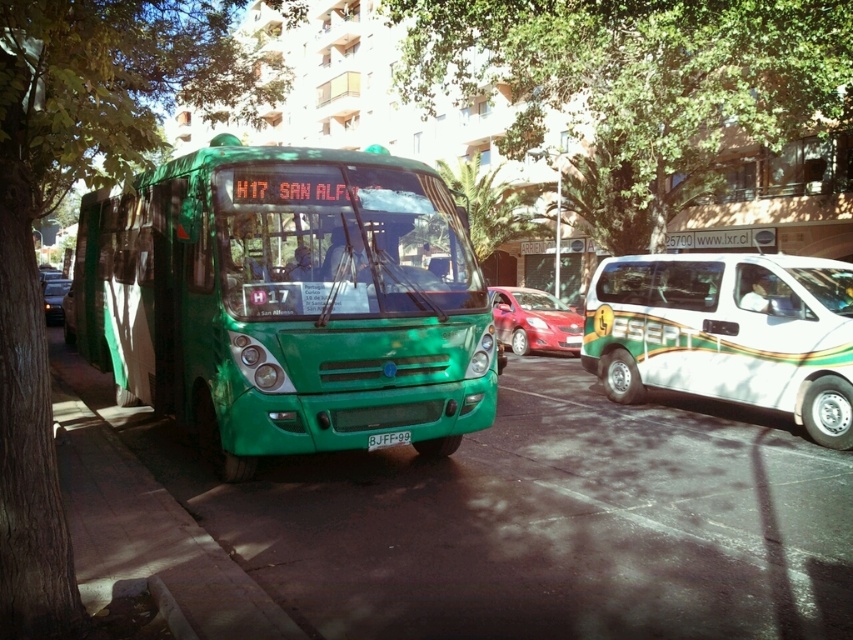
You are a delivery person who needs to attach a sticker to the license plate of the green matte bus at center. The sticker requires a minimum of 15 cm of space. Can you confirm if the black plastic license plate at center has enough space for the sticker?

The green matte bus at center is bigger than the black plastic license plate at center, but the size of the license plate itself isn not specified. Therefore, it is uncertain if the black plastic license plate at center has enough space for the 15 cm sticker requirement.

You are a delivery person who needs to attach a GPS tracker to the green matte bus at center. The GPS tracker must be placed exactly 28 inches away from the black plastic license plate at center. Can you place it on the bus?

The green matte bus at center is 27.88 inches from the black plastic license plate at center. Since the required distance is 28 inches, the GPS tracker cannot be placed at the current position of the license plate. You would need to move it approximately 0.12 inches further away from the license plate to meet the requirement.